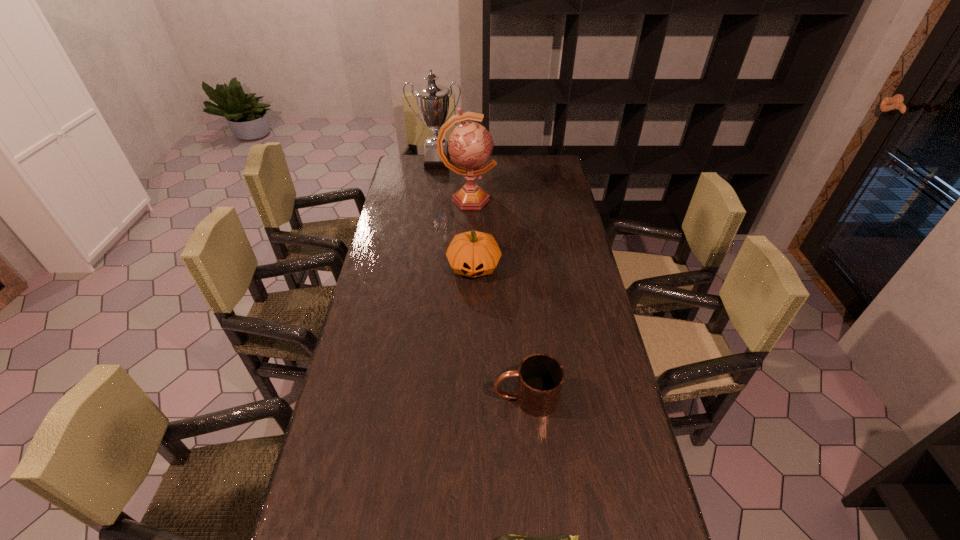
Locate an element on the screen. This screenshot has height=540, width=960. blank region between the second nearest object and the third tallest object is located at coordinates (500, 332).

Identify the location of object that is the third closest to the fourth tallest object. This screenshot has width=960, height=540. (470, 144).

Locate an element on the screen. object that stands as the fourth closest to the farthest object is located at coordinates (507, 539).